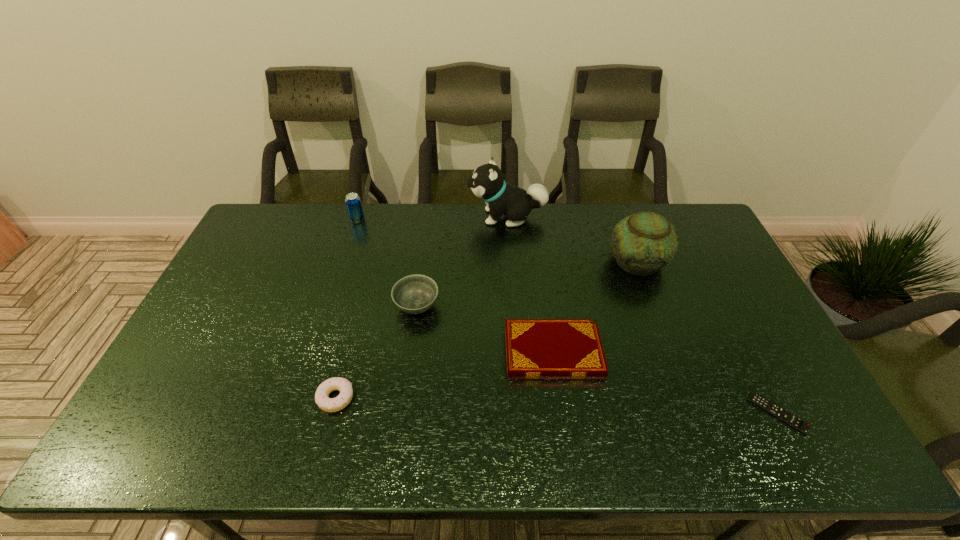
This screenshot has width=960, height=540. In order to click on puppy in this screenshot , I will do `click(487, 182)`.

At what (x,y) coordinates should I click in order to perform the action: click on the sixth object from left to right. Please return your answer as a coordinate pair (x, y). The height and width of the screenshot is (540, 960). Looking at the image, I should click on (644, 242).

Identify the location of the fifth nearest object. Image resolution: width=960 pixels, height=540 pixels. (644, 242).

Where is `the leftmost object`? The width and height of the screenshot is (960, 540). the leftmost object is located at coordinates (353, 202).

The image size is (960, 540). Identify the location of the fifth shortest object. (353, 202).

At what (x,y) coordinates should I click in order to perform the action: click on bowl. Please return your answer as a coordinate pair (x, y). Looking at the image, I should click on (414, 294).

I want to click on the fourth farthest object, so click(414, 294).

Find the location of a particular element. the fifth farthest object is located at coordinates (535, 348).

Find the location of a particular element. doughnut is located at coordinates (322, 399).

The width and height of the screenshot is (960, 540). I want to click on the shortest object, so click(x=776, y=411).